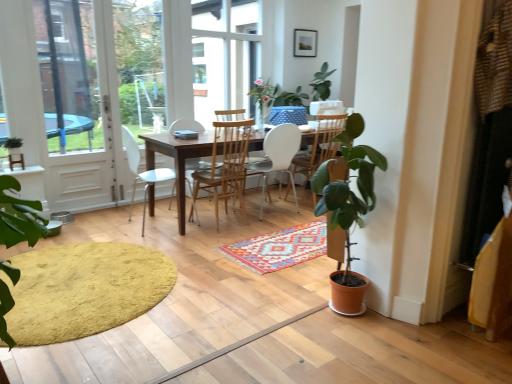
This screenshot has height=384, width=512. Identify the location of free space in front of green matte plant at lower right. (350, 350).